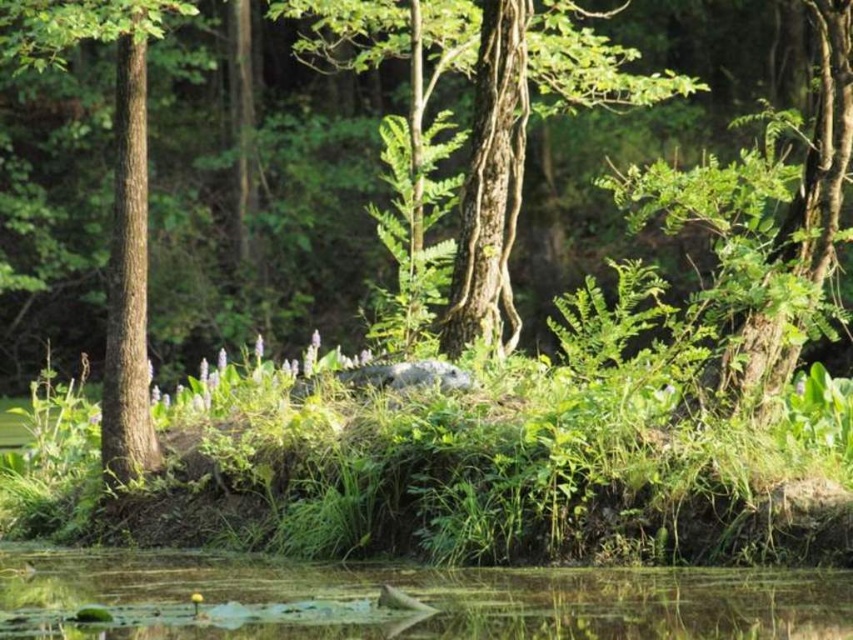
Question: Which of the following is the closest to the observer?

Choices:
 (A) brown rough bark tree at left
 (B) greenish murky water at lower center

Answer: (B)

Question: Which point appears closest to the camera in this image?

Choices:
 (A) (596, 602)
 (B) (107, 467)

Answer: (A)

Question: Can you confirm if greenish murky water at lower center is positioned to the right of brown rough bark tree at left?

Choices:
 (A) yes
 (B) no

Answer: (A)

Question: Can you confirm if greenish murky water at lower center is positioned to the right of brown rough bark tree at left?

Choices:
 (A) yes
 (B) no

Answer: (A)

Question: In this image, where is greenish murky water at lower center located relative to brown rough bark tree at left?

Choices:
 (A) above
 (B) below

Answer: (B)